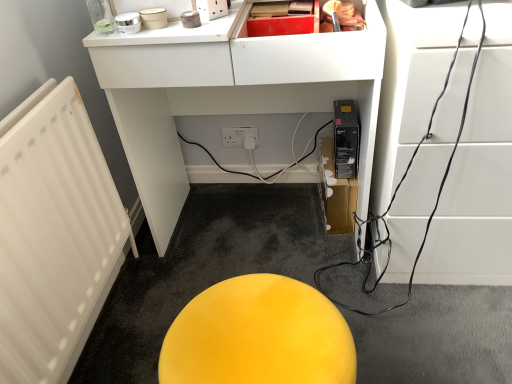
Question: From the image's perspective, relative to matte black computer tower at lower center, the 3th furniture from the right, is black glossy cable at right, the 1th furniture positioned from the right, above or below?

Choices:
 (A) above
 (B) below

Answer: (B)

Question: Is point (479, 21) closer or farther from the camera than point (139, 54)?

Choices:
 (A) farther
 (B) closer

Answer: (B)

Question: Estimate the real-world distances between objects in this image. Which object is closer to the yellow matte stool at center, which appears as the second furniture when viewed from the right?

Choices:
 (A) black glossy cable at right, which appears as the third furniture when viewed from the left
 (B) matte black computer tower at lower center, which is the first furniture from left to right

Answer: (A)

Question: Estimate the real-world distances between objects in this image. Which object is closer to the black glossy cable at right, which appears as the third furniture when viewed from the left?

Choices:
 (A) matte black computer tower at lower center, the 3th furniture from the right
 (B) yellow matte stool at center, which appears as the second furniture when viewed from the right

Answer: (A)